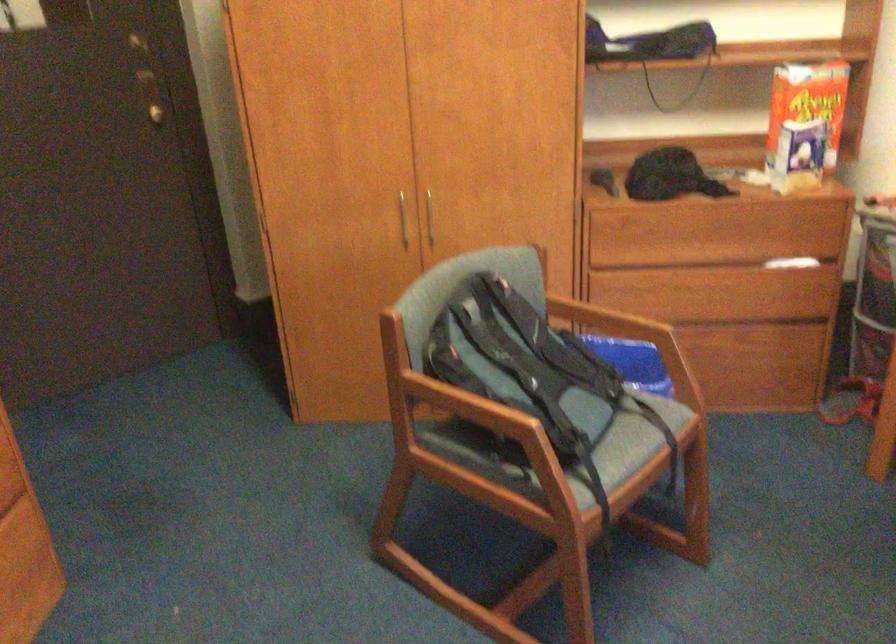
You are a GUI agent. You are given a task and a screenshot of the screen. Output one action in this format:
    pyautogui.click(x=<x>, y=<y>)
    Task: Click on the gold door knob
    The height and width of the screenshot is (644, 896).
    Given the screenshot: What is the action you would take?
    pyautogui.click(x=158, y=111)